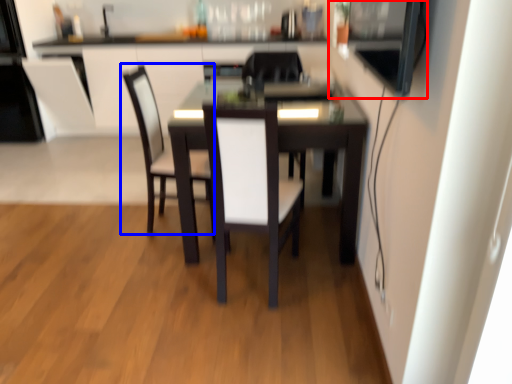
Question: Among these objects, which one is farthest to the camera, appliance (highlighted by a red box) or chair (highlighted by a blue box)?

Choices:
 (A) appliance
 (B) chair

Answer: (B)